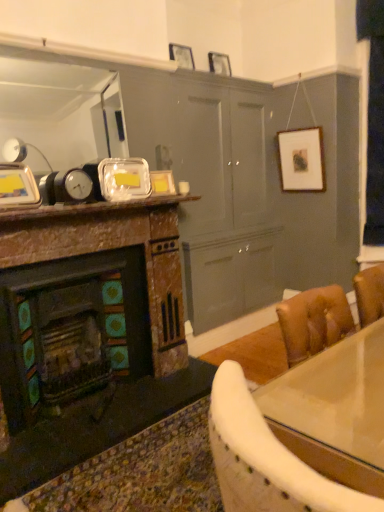
Question: Relative to matte silver picture frame at upper center, the fifth picture frame from the bottom, is shiny glass table at lower right in front or behind?

Choices:
 (A) front
 (B) behind

Answer: (A)

Question: Does point (321, 408) appear closer or farther from the camera than point (208, 61)?

Choices:
 (A) farther
 (B) closer

Answer: (B)

Question: Considering the real-world distances, which object is farthest from the metallic silver picture frame at upper left, the 5th picture frame when ordered from back to front?

Choices:
 (A) matte silver picture frame at upper center, which is the 4th picture frame in left-to-right order
 (B) white glossy coffee cup at center
 (C) wooden picture frame at upper center, which is the 4th picture frame from bottom to top
 (D) matte glass picture frame at upper center, which is counted as the 4th picture frame, starting from the top
 (E) shiny glass table at lower right

Answer: (A)

Question: Considering the real-world distances, which object is farthest from the shiny glass table at lower right?

Choices:
 (A) wooden picture frame at upper center, the third picture frame viewed from the right
 (B) matte glass picture frame at upper center, which is counted as the 4th picture frame, starting from the top
 (C) metallic silver picture frame at upper left, the 1th picture frame from the bottom
 (D) white glossy coffee cup at center
 (E) rustic stone fireplace at left

Answer: (A)